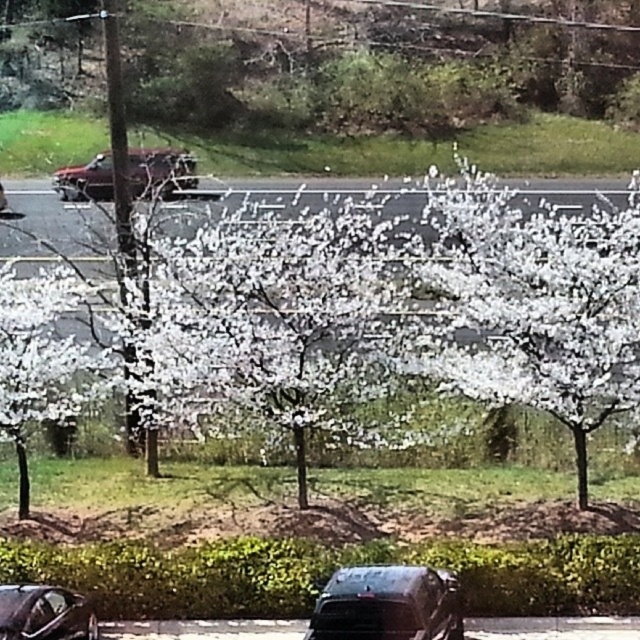
Is dark gray metallic car at lower center to the right of shiny black car at lower left from the viewer's perspective?

Indeed, dark gray metallic car at lower center is positioned on the right side of shiny black car at lower left.

Is dark gray metallic car at lower center above shiny black car at lower left?

Yes, dark gray metallic car at lower center is above shiny black car at lower left.

Is point (428, 573) farther from camera compared to point (51, 634)?

Yes, it is.

I want to click on dark gray metallic car at lower center, so click(387, 604).

Is white matte tree at center taller than metallic maroon suv at center?

Yes, white matte tree at center is taller than metallic maroon suv at center.

Who is more forward, (524, 394) or (90, 189)?

Positioned in front is point (524, 394).

Where is `white matte tree at center`? The image size is (640, 640). white matte tree at center is located at coordinates (396, 308).

Consider the image. Does dark gray metallic car at lower center have a smaller size compared to metallic maroon suv at center?

Correct, dark gray metallic car at lower center occupies less space than metallic maroon suv at center.

Can you confirm if dark gray metallic car at lower center is positioned to the right of metallic maroon suv at center?

Yes, dark gray metallic car at lower center is to the right of metallic maroon suv at center.

Does point (419, 621) lie in front of point (156, 164)?

Yes, point (419, 621) is closer to viewer.

Locate an element on the screen. dark gray metallic car at lower center is located at coordinates (387, 604).